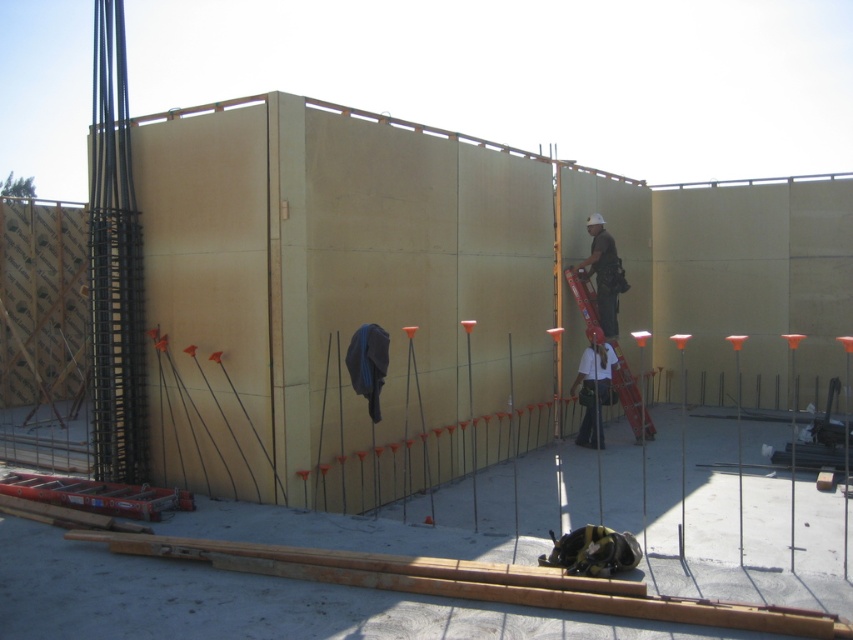
Question: Does white fabric construction worker at center appear under matte white helmet at center?

Choices:
 (A) no
 (B) yes

Answer: (B)

Question: Which of these objects is positioned closest to the matte white helmet at center?

Choices:
 (A) metallic red ladder at center
 (B) white fabric construction worker at center

Answer: (A)

Question: Among these points, which one is nearest to the camera?

Choices:
 (A) (612, 346)
 (B) (596, 268)
 (C) (579, 387)

Answer: (A)

Question: Is white fabric construction worker at center smaller than metallic red ladder at center?

Choices:
 (A) no
 (B) yes

Answer: (B)

Question: Is white fabric construction worker at center above matte white helmet at center?

Choices:
 (A) yes
 (B) no

Answer: (B)

Question: Which object is closer to the camera taking this photo?

Choices:
 (A) metallic red ladder at center
 (B) matte white helmet at center

Answer: (A)